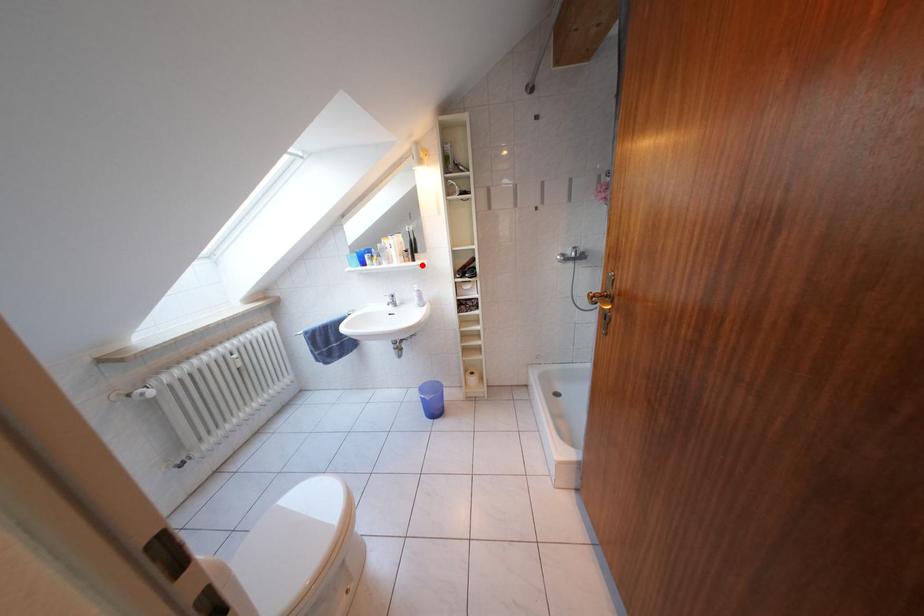
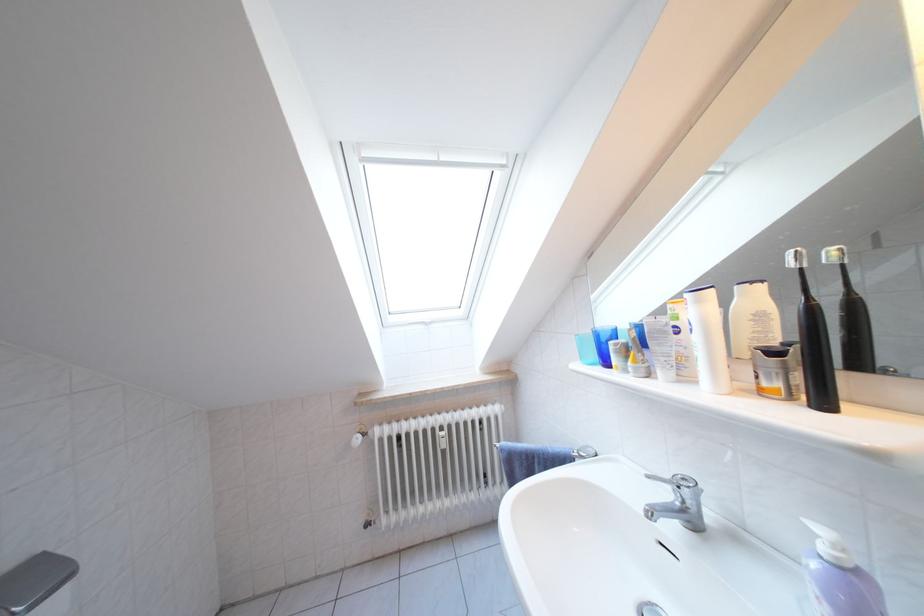
The point at the highlighted location is marked in the first image. Where is the corresponding point in the second image?

(833, 407)